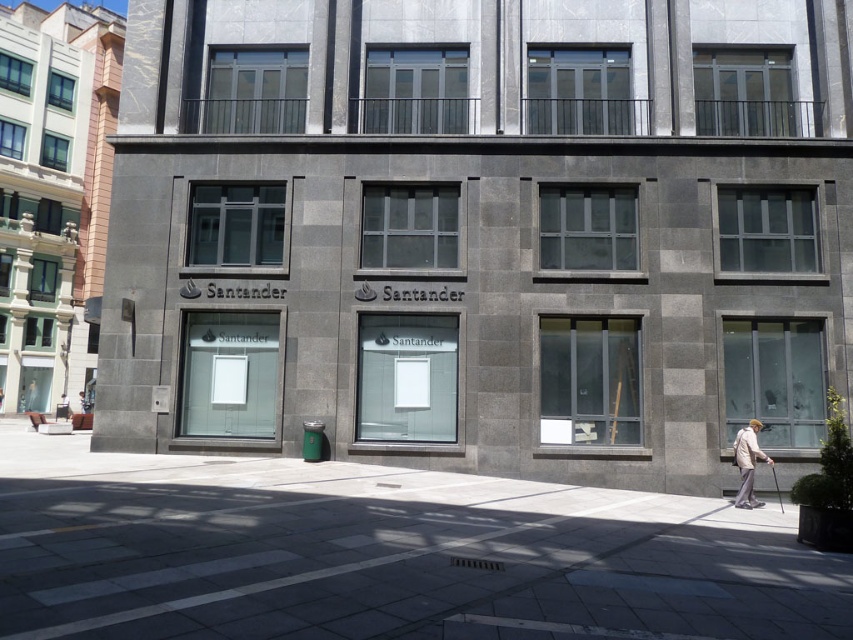
Question: Which object is closer to the camera taking this photo?

Choices:
 (A) light beige fabric coat at lower right
 (B) gray concrete pavement at center

Answer: (B)

Question: Is brown leather bag at lower left bigger than white fabric at center?

Choices:
 (A) yes
 (B) no

Answer: (A)

Question: Can you confirm if gray concrete pavement at center is thinner than brown leather bag at lower left?

Choices:
 (A) no
 (B) yes

Answer: (A)

Question: Which point is farther to the camera?

Choices:
 (A) light beige fabric coat at lower right
 (B) brown leather bag at lower left

Answer: (B)

Question: Among these points, which one is nearest to the camera?

Choices:
 (A) (392, 576)
 (B) (738, 429)
 (C) (62, 394)
 (D) (80, 392)

Answer: (A)

Question: From the image, what is the correct spatial relationship of gray concrete pavement at center in relation to white fabric at center?

Choices:
 (A) above
 (B) below

Answer: (A)